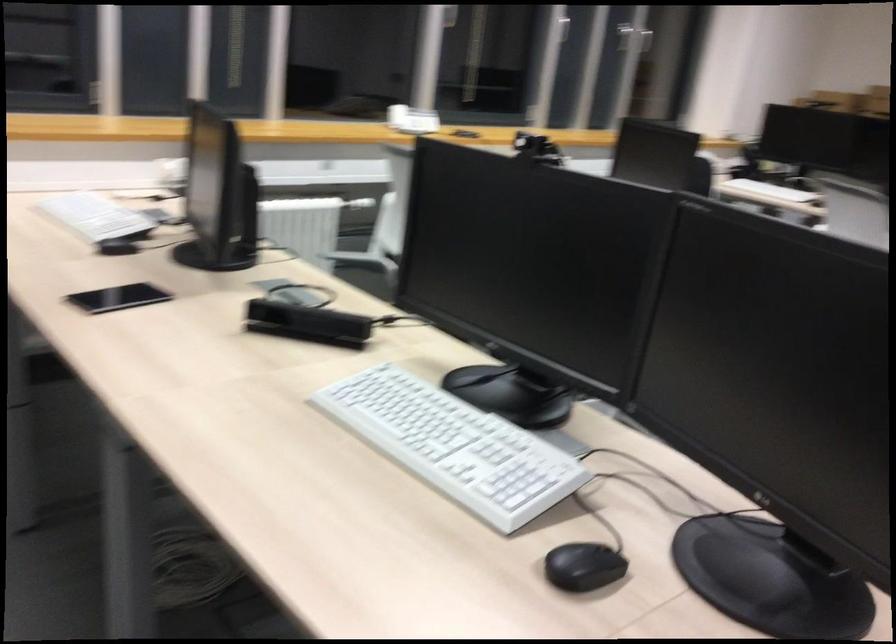
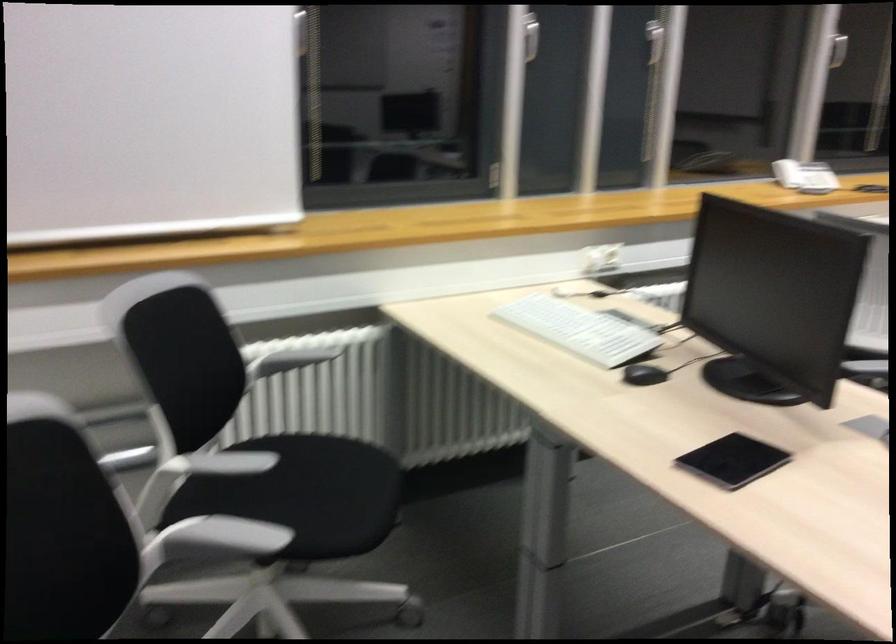
Question: The images are taken continuously from a first-person perspective. In which direction are you moving?

Choices:
 (A) Left
 (B) Right
 (C) Forward
 (D) Backward

Answer: (A)